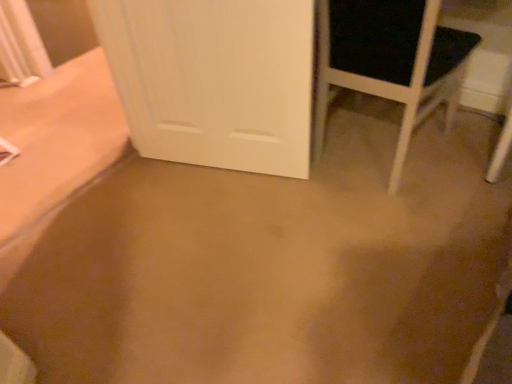
Question: From a real-world perspective, is black matte chair at right beneath white wood door at center?

Choices:
 (A) yes
 (B) no

Answer: (A)

Question: Is black matte chair at right not inside white wood door at center?

Choices:
 (A) no
 (B) yes

Answer: (B)

Question: Is the position of black matte chair at right less distant than that of white wood door at center?

Choices:
 (A) no
 (B) yes

Answer: (B)

Question: Is black matte chair at right next to white wood door at center and touching it?

Choices:
 (A) no
 (B) yes

Answer: (A)

Question: Considering the relative positions of black matte chair at right and white wood door at center in the image provided, is black matte chair at right to the left of white wood door at center from the viewer's perspective?

Choices:
 (A) yes
 (B) no

Answer: (B)

Question: Can you confirm if black matte chair at right is positioned to the right of white wood door at center?

Choices:
 (A) no
 (B) yes

Answer: (B)

Question: Is white wood door at center bigger than black matte chair at right?

Choices:
 (A) no
 (B) yes

Answer: (A)

Question: Can you confirm if white wood door at center is positioned to the right of black matte chair at right?

Choices:
 (A) yes
 (B) no

Answer: (B)

Question: Is white wood door at center closer to the viewer compared to black matte chair at right?

Choices:
 (A) no
 (B) yes

Answer: (A)

Question: From a real-world perspective, does white wood door at center stand above black matte chair at right?

Choices:
 (A) yes
 (B) no

Answer: (A)

Question: From the image's perspective, does white wood door at center appear lower than black matte chair at right?

Choices:
 (A) yes
 (B) no

Answer: (A)

Question: Is white wood door at center outside black matte chair at right?

Choices:
 (A) yes
 (B) no

Answer: (A)

Question: Which is correct: white wood door at center is inside black matte chair at right, or outside of it?

Choices:
 (A) outside
 (B) inside

Answer: (A)